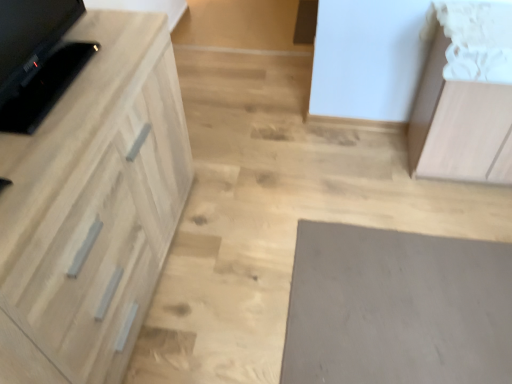
Identify the location of free point to the left of light brown wood cabinet at upper right, the 2th cabinetry viewed from the left. The image size is (512, 384). (372, 173).